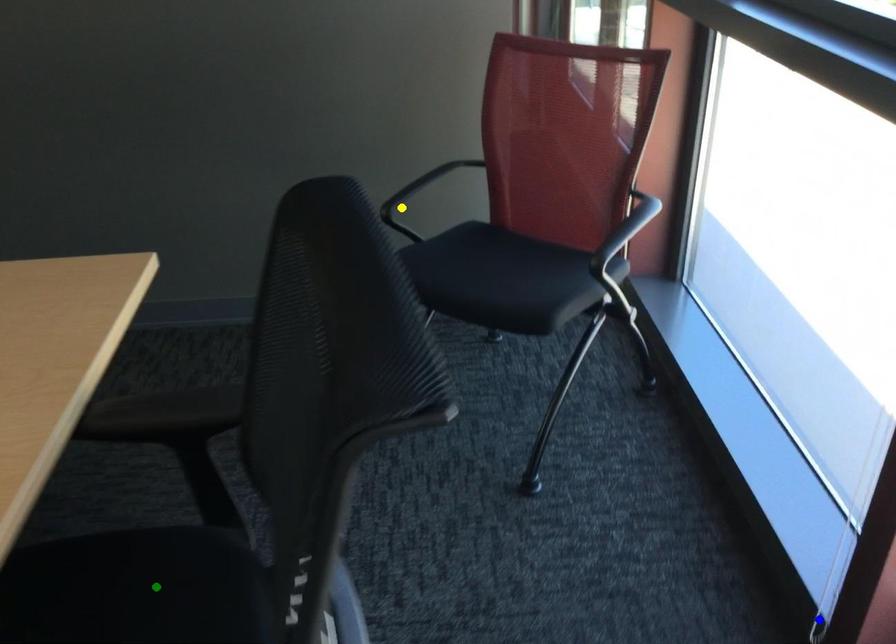
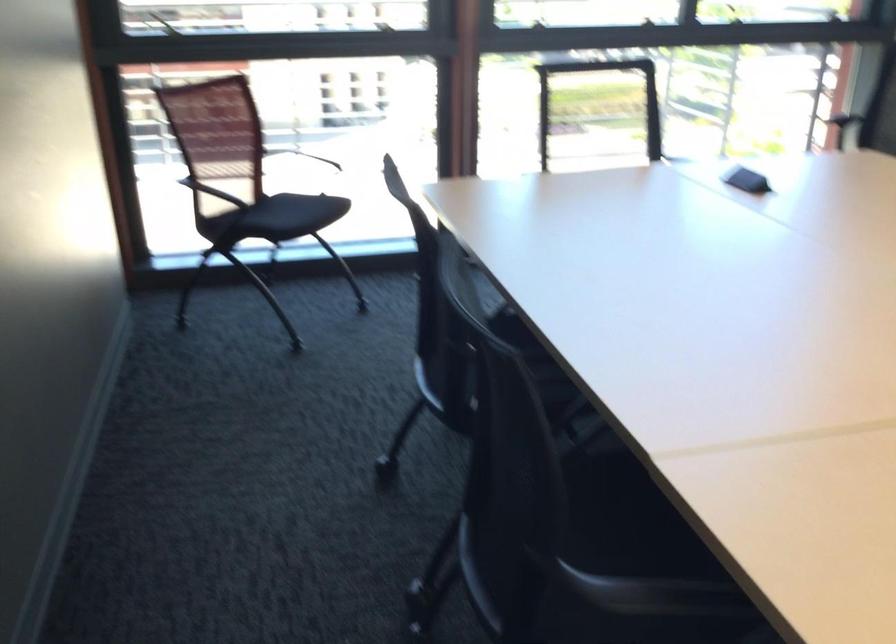
I am providing you with two images of the same scene from different viewpoints. Three points are marked in image1. Which point corresponds to a part or object that is occluded in image2?In image1, three points are marked. Which of them correspond to a part or object that is occluded in image2?Among the three points shown in image1, which one corresponds to a part or object that is no longer visible due to occlusion in image2?

yellow point, blue point, green point